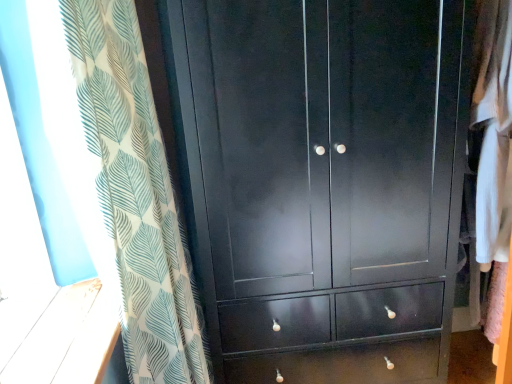
The height and width of the screenshot is (384, 512). I want to click on white leaf-patterned curtain at left, so click(136, 195).

This screenshot has height=384, width=512. Describe the element at coordinates (136, 195) in the screenshot. I see `white leaf-patterned curtain at left` at that location.

Find the location of a particular element. matte black wardrobe at center is located at coordinates (322, 182).

Describe the element at coordinates (322, 182) in the screenshot. I see `matte black wardrobe at center` at that location.

You are a GUI agent. You are given a task and a screenshot of the screen. Output one action in this format:
    pyautogui.click(x=<x>, y=<y>)
    Task: Click on the white leaf-patterned curtain at left
    
    Given the screenshot: What is the action you would take?
    pyautogui.click(x=136, y=195)

Which is more to the right, white leaf-patterned curtain at left or matte black wardrobe at center?

Positioned to the right is matte black wardrobe at center.

Considering their positions, is white leaf-patterned curtain at left located in front of or behind matte black wardrobe at center?

Clearly, white leaf-patterned curtain at left is in front of matte black wardrobe at center.

Which is behind, point (120, 252) or point (373, 183)?

The point (373, 183) is farther from the camera.

From the image's perspective, is white leaf-patterned curtain at left beneath matte black wardrobe at center?

Indeed, from the image's perspective, white leaf-patterned curtain at left is shown beneath matte black wardrobe at center.

From a real-world perspective, which object rests below the other?

From a 3D spatial view, matte black wardrobe at center is below.

Between white leaf-patterned curtain at left and matte black wardrobe at center, which one has smaller width?

Thinner between the two is white leaf-patterned curtain at left.

Does white leaf-patterned curtain at left have a greater height compared to matte black wardrobe at center?

In fact, white leaf-patterned curtain at left may be shorter than matte black wardrobe at center.

Considering the relative sizes of white leaf-patterned curtain at left and matte black wardrobe at center in the image provided, is white leaf-patterned curtain at left bigger than matte black wardrobe at center?

Actually, white leaf-patterned curtain at left might be smaller than matte black wardrobe at center.

Consider the image. Would you say white leaf-patterned curtain at left is inside or outside matte black wardrobe at center?

white leaf-patterned curtain at left is not enclosed by matte black wardrobe at center.

Is there a large distance between white leaf-patterned curtain at left and matte black wardrobe at center?

No, white leaf-patterned curtain at left is in close proximity to matte black wardrobe at center.

Is white leaf-patterned curtain at left aimed at matte black wardrobe at center?

Yes, white leaf-patterned curtain at left is oriented towards matte black wardrobe at center.

Where is `cupboard that appears behind the white leaf-patterned curtain at left`? This screenshot has height=384, width=512. cupboard that appears behind the white leaf-patterned curtain at left is located at coordinates pyautogui.click(x=322, y=182).

Considering the relative positions of matte black wardrobe at center and white leaf-patterned curtain at left in the image provided, is matte black wardrobe at center to the right of white leaf-patterned curtain at left from the viewer's perspective?

Yes, matte black wardrobe at center is to the right of white leaf-patterned curtain at left.

Is the position of matte black wardrobe at center less distant than that of white leaf-patterned curtain at left?

No, the depth of matte black wardrobe at center is greater than that of white leaf-patterned curtain at left.

Which point is more forward, (390,299) or (123,153)?

The point (123,153) is in front.

From the image's perspective, relative to white leaf-patterned curtain at left, is matte black wardrobe at center above or below?

From the image's perspective, matte black wardrobe at center appears above white leaf-patterned curtain at left.

From a real-world perspective, is matte black wardrobe at center on white leaf-patterned curtain at left?

No, from a real-world perspective, matte black wardrobe at center is not on top of white leaf-patterned curtain at left.

From the picture: Considering the sizes of objects matte black wardrobe at center and white leaf-patterned curtain at left in the image provided, who is thinner, matte black wardrobe at center or white leaf-patterned curtain at left?

white leaf-patterned curtain at left.

Considering the relative sizes of matte black wardrobe at center and white leaf-patterned curtain at left in the image provided, is matte black wardrobe at center shorter than white leaf-patterned curtain at left?

In fact, matte black wardrobe at center may be taller than white leaf-patterned curtain at left.

In terms of size, does matte black wardrobe at center appear bigger or smaller than white leaf-patterned curtain at left?

Considering their sizes, matte black wardrobe at center takes up more space than white leaf-patterned curtain at left.

Would you say matte black wardrobe at center contains white leaf-patterned curtain at left?

Definitely not — white leaf-patterned curtain at left is not inside matte black wardrobe at center.

Is matte black wardrobe at center far away from white leaf-patterned curtain at left?

No, matte black wardrobe at center is not far from white leaf-patterned curtain at left.

Could you tell me if matte black wardrobe at center is facing white leaf-patterned curtain at left?

No, matte black wardrobe at center is not oriented towards white leaf-patterned curtain at left.

Measure the distance between matte black wardrobe at center and white leaf-patterned curtain at left.

matte black wardrobe at center and white leaf-patterned curtain at left are 15.68 inches apart.

The image size is (512, 384). Find the location of `curtain on the left of matte black wardrobe at center`. curtain on the left of matte black wardrobe at center is located at coordinates (136, 195).

Locate an element on the screen. The image size is (512, 384). cupboard on the right of white leaf-patterned curtain at left is located at coordinates (322, 182).

Identify the location of curtain on the left side of matte black wardrobe at center. The width and height of the screenshot is (512, 384). (136, 195).